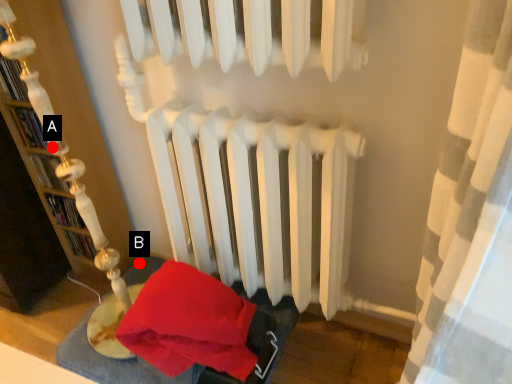
Question: Two points are circled on the image, labeled by A and B beside each circle. Which point is closer to the camera?

Choices:
 (A) A is closer
 (B) B is closer

Answer: (A)